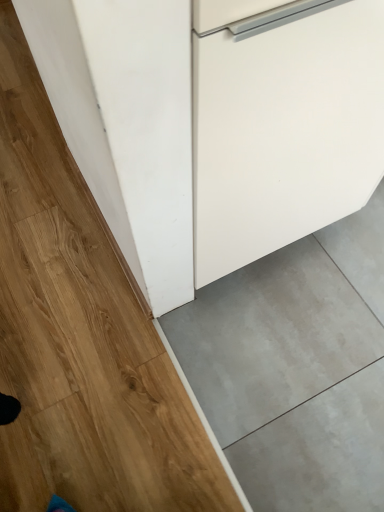
Question: Should I look upward or downward to see wooden floor at lower left?

Choices:
 (A) up
 (B) down

Answer: (A)